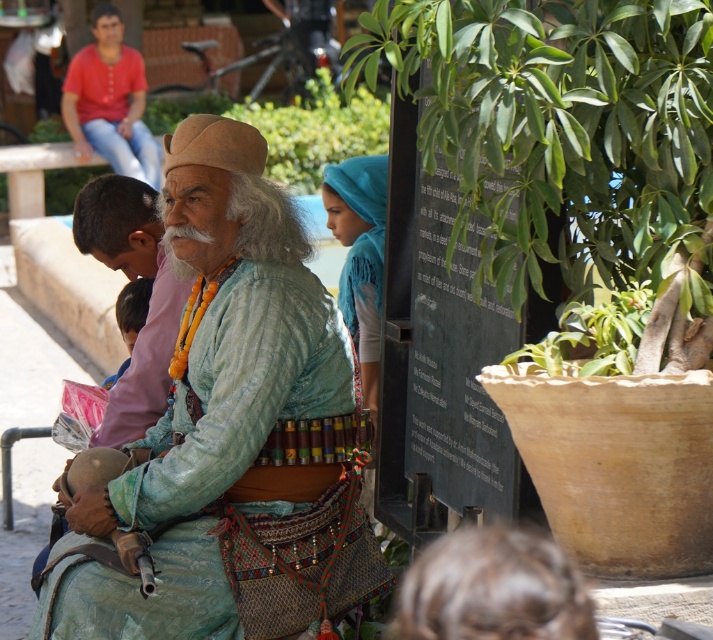
Does pink fabric at center have a smaller size compared to matte red shirt at upper left?

Yes, pink fabric at center is smaller than matte red shirt at upper left.

Does pink fabric at center lie in front of matte red shirt at upper left?

Yes, it is.

Describe the element at coordinates (133, 280) in the screenshot. This screenshot has height=640, width=713. I see `pink fabric at center` at that location.

The width and height of the screenshot is (713, 640). In order to click on pink fabric at center in this screenshot , I will do `click(133, 280)`.

Who is higher up, turquoise fabric at center or pink fabric at center?

pink fabric at center is higher up.

Does point (61, 499) lie behind point (118, 385)?

No, (61, 499) is in front of (118, 385).

Does point (309, 481) come behind point (128, 410)?

No.

Where is `turquoise fabric at center`? Image resolution: width=713 pixels, height=640 pixels. turquoise fabric at center is located at coordinates (227, 433).

Is turquoise fabric at center to the right of matte red shirt at upper left from the viewer's perspective?

Indeed, turquoise fabric at center is positioned on the right side of matte red shirt at upper left.

Is turquoise fabric at center further to camera compared to matte red shirt at upper left?

No, it is in front of matte red shirt at upper left.

Between point (247, 588) and point (120, 52), which one is positioned behind?

Point (120, 52)

Identify the location of turquoise fabric at center. (227, 433).